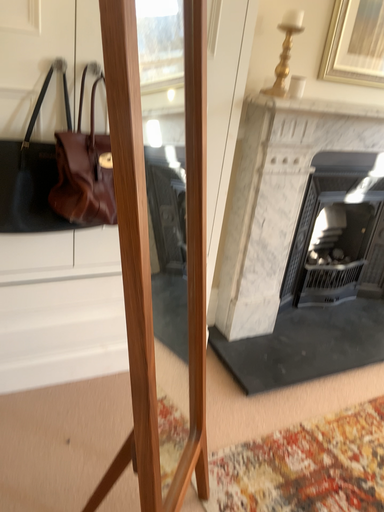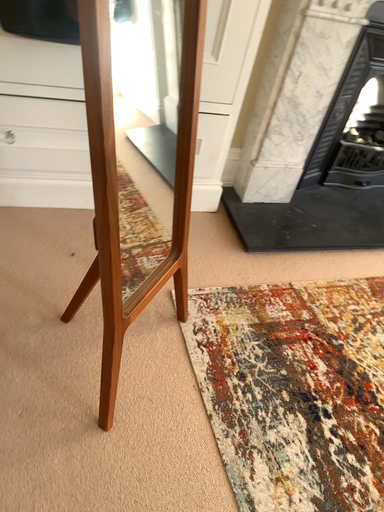
Question: Which way did the camera rotate in the video?

Choices:
 (A) rotated right
 (B) rotated left

Answer: (B)